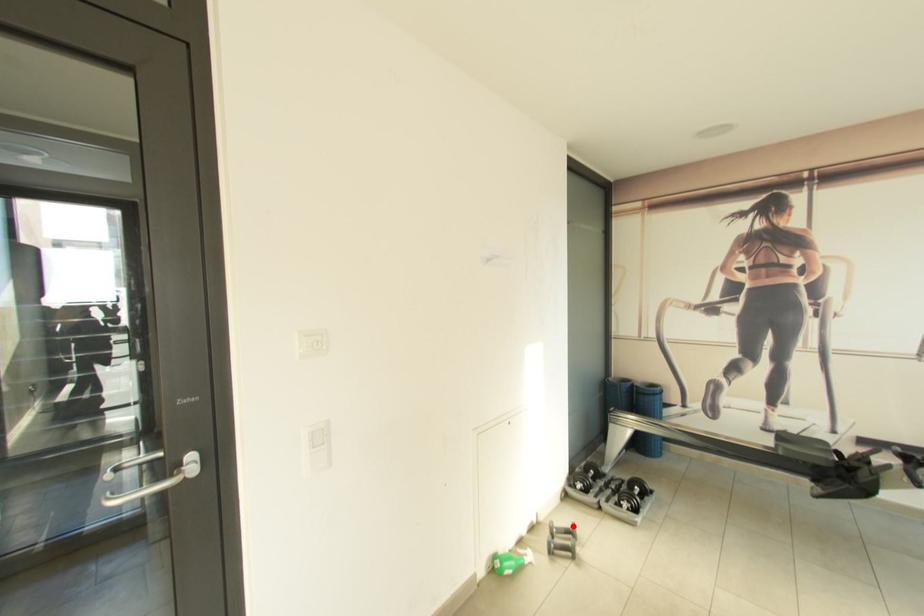
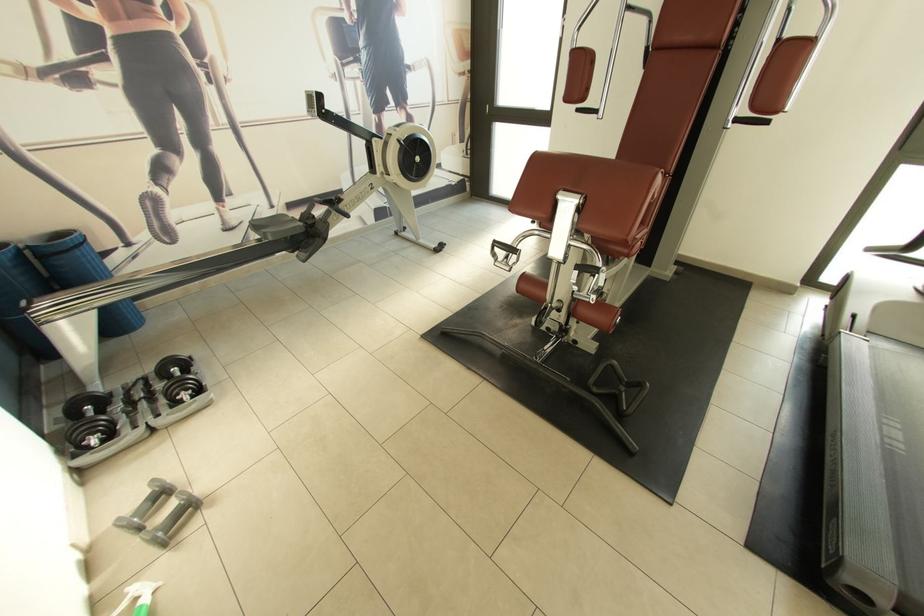
Where in the second image is the point corresponding to the highlighted location from the first image?

(152, 493)